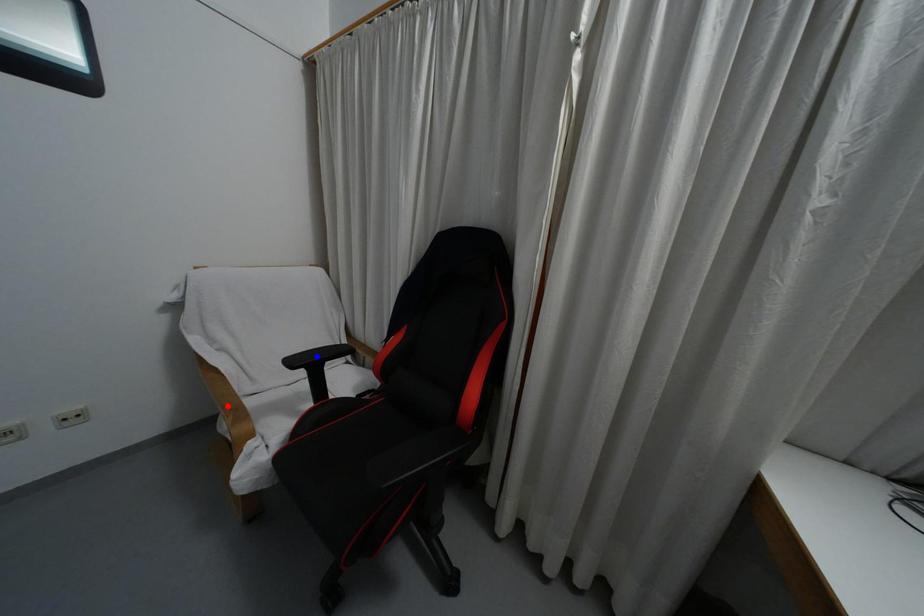
Question: Two points are marked on the image. Which point is closer to the camera?

Choices:
 (A) Blue point is closer.
 (B) Red point is closer.

Answer: (B)